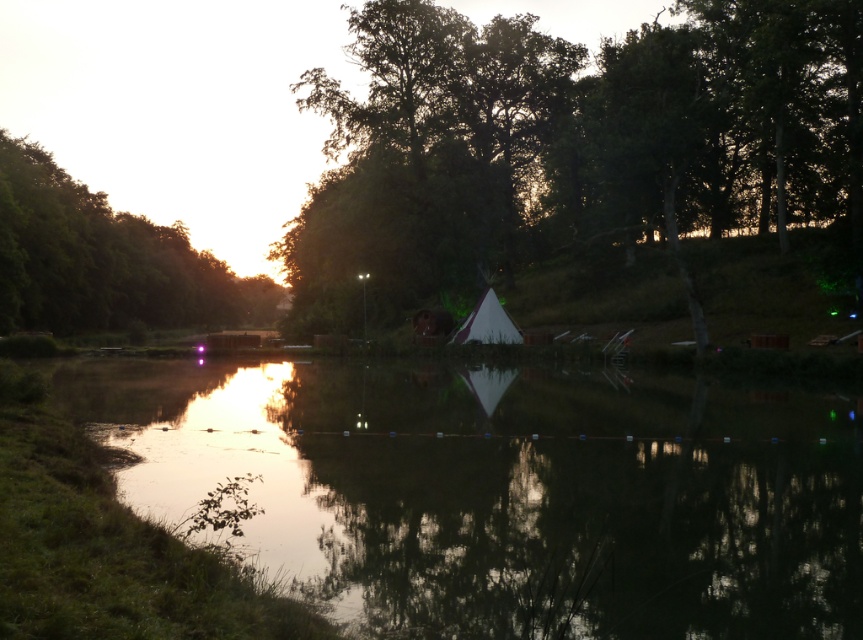
Question: Does green leafy tree at center come behind green leafy tree at upper left?

Choices:
 (A) no
 (B) yes

Answer: (A)

Question: Estimate the real-world distances between objects in this image. Which object is closer to the reflective glass water at center?

Choices:
 (A) green leafy tree at center
 (B) green leafy tree at upper left

Answer: (A)

Question: Does reflective glass water at center appear over green leafy tree at upper left?

Choices:
 (A) no
 (B) yes

Answer: (A)

Question: Which of the following is the closest to the observer?

Choices:
 (A) green leafy tree at center
 (B) reflective glass water at center
 (C) green leafy tree at upper left

Answer: (B)

Question: Is reflective glass water at center thinner than green leafy tree at center?

Choices:
 (A) no
 (B) yes

Answer: (B)

Question: Which of these objects is positioned closest to the reflective glass water at center?

Choices:
 (A) green leafy tree at upper left
 (B) green leafy tree at center

Answer: (B)